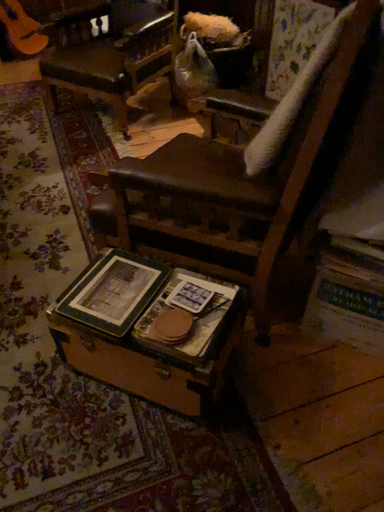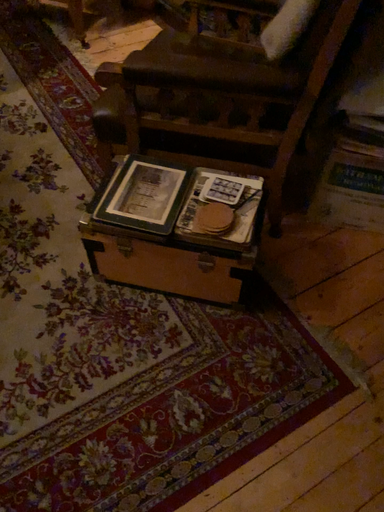
Question: Which way did the camera rotate in the video?

Choices:
 (A) rotated downward
 (B) rotated upward

Answer: (A)